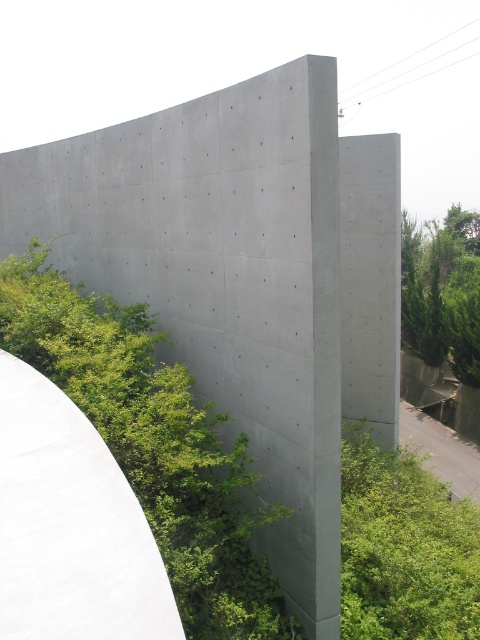
You are standing in front of the modern architectural structure with the gray concrete wall and the curved white element. There is a point marked at coordinates [153,444]. What object is located at this point?

The point at coordinates [153,444] has a green leafy shrub at center left.